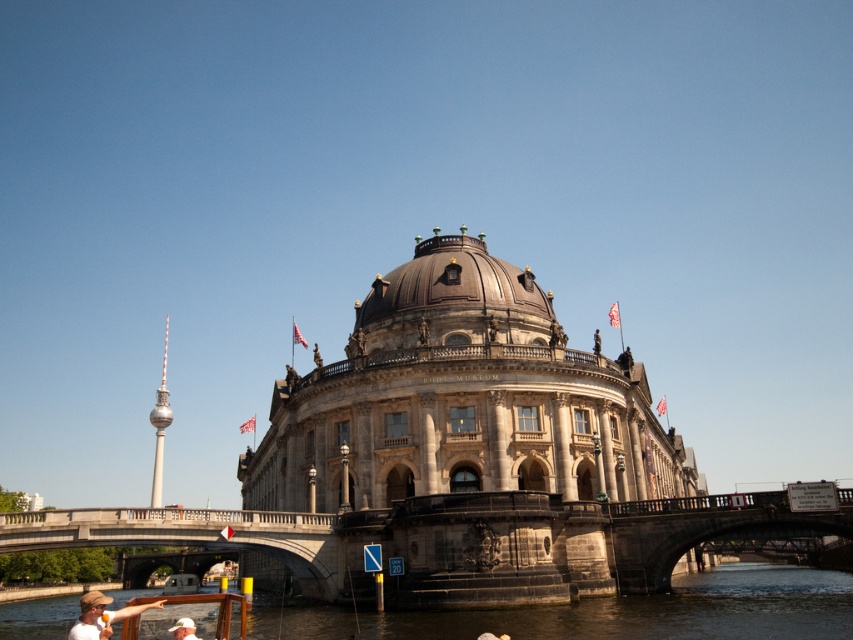
Does stone bridge at lower center come in front of matte white shirt at lower left?

No, it is not.

Looking at this image, does stone bridge at lower center have a smaller size compared to matte white shirt at lower left?

Indeed, stone bridge at lower center has a smaller size compared to matte white shirt at lower left.

Between point (314, 560) and point (80, 616), which one is positioned in front?

Point (314, 560) is more forward.

Identify the location of stone bridge at lower center. 454,540.

Does dark blue water at lower center have a lesser width compared to brown polished dome at center?

No, dark blue water at lower center is not thinner than brown polished dome at center.

Describe the element at coordinates (660, 611) in the screenshot. Image resolution: width=853 pixels, height=640 pixels. I see `dark blue water at lower center` at that location.

Image resolution: width=853 pixels, height=640 pixels. I want to click on dark blue water at lower center, so click(660, 611).

Image resolution: width=853 pixels, height=640 pixels. I want to click on dark blue water at lower center, so click(x=660, y=611).

Is dark blue water at lower center behind white fabric hat at lower center?

Yes, dark blue water at lower center is behind white fabric hat at lower center.

Looking at this image, who is more distant from viewer, (705, 630) or (184, 621)?

Positioned behind is point (705, 630).

This screenshot has width=853, height=640. Find the location of `dark blue water at lower center`. dark blue water at lower center is located at coordinates (660, 611).